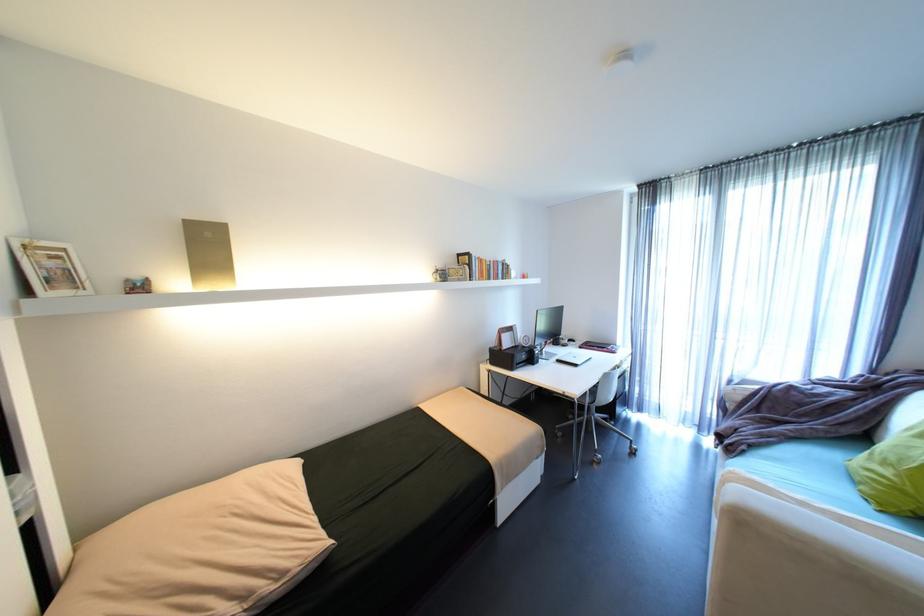
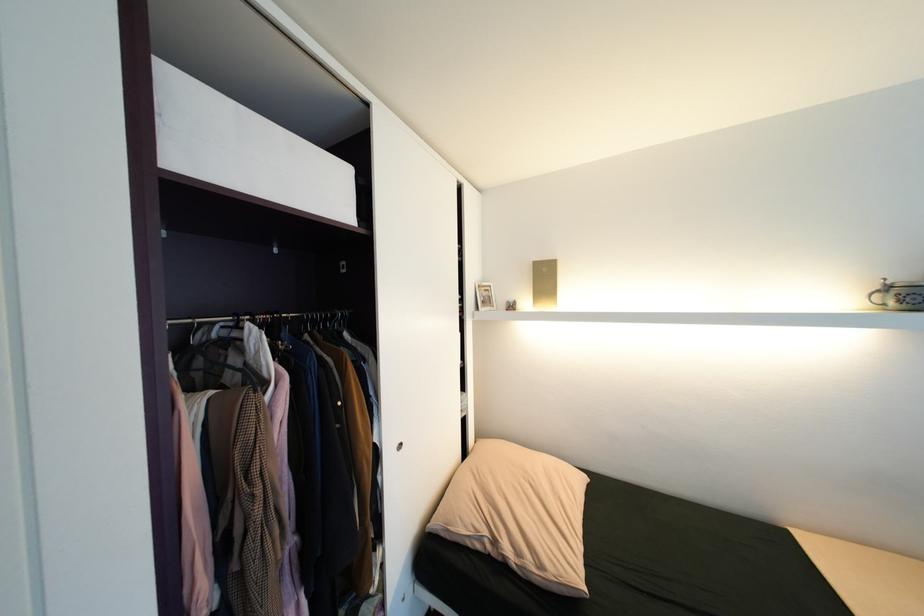
Question: The camera is either moving clockwise (left) or counter-clockwise (right) around the object. The first image is from the beginning of the video and the second image is from the end. Is the camera moving left or right when shooting the video?

Choices:
 (A) Left
 (B) Right

Answer: (B)